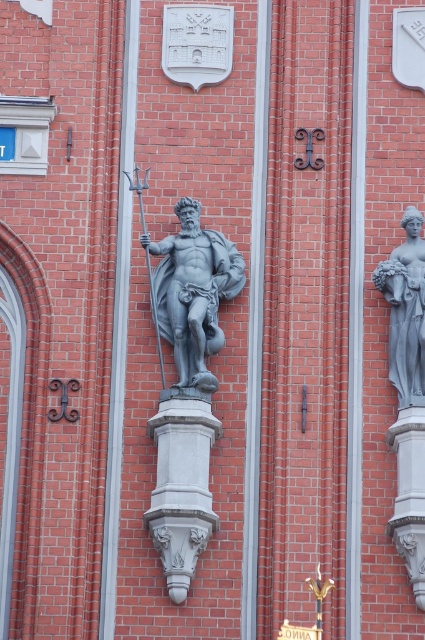
Is the position of gray stone pedestal at center more distant than that of smooth gray stone at center?

No, it is in front of smooth gray stone at center.

Is gray stone pedestal at center wider than smooth gray stone at center?

Indeed, gray stone pedestal at center has a greater width compared to smooth gray stone at center.

The height and width of the screenshot is (640, 425). Describe the element at coordinates (181, 483) in the screenshot. I see `gray stone pedestal at center` at that location.

Where is `gray stone pedestal at center`? This screenshot has height=640, width=425. gray stone pedestal at center is located at coordinates (181, 483).

Does polished gray statue at center have a larger size compared to smooth gray stone at center?

Actually, polished gray statue at center might be smaller than smooth gray stone at center.

Between polished gray statue at center and smooth gray stone at center, which one has less height?

polished gray statue at center

The height and width of the screenshot is (640, 425). Describe the element at coordinates (193, 291) in the screenshot. I see `polished gray statue at center` at that location.

The width and height of the screenshot is (425, 640). Find the location of `polished gray statue at center`. polished gray statue at center is located at coordinates (193, 291).

Does gray stone pedestal at center have a larger size compared to matte gray statue at right?

Indeed, gray stone pedestal at center has a larger size compared to matte gray statue at right.

Does gray stone pedestal at center have a lesser height compared to matte gray statue at right?

Indeed, gray stone pedestal at center has a lesser height compared to matte gray statue at right.

Who is more forward, (167, 531) or (422, 355)?

Point (167, 531) is in front.

Locate an element on the screen. gray stone pedestal at center is located at coordinates (181, 483).